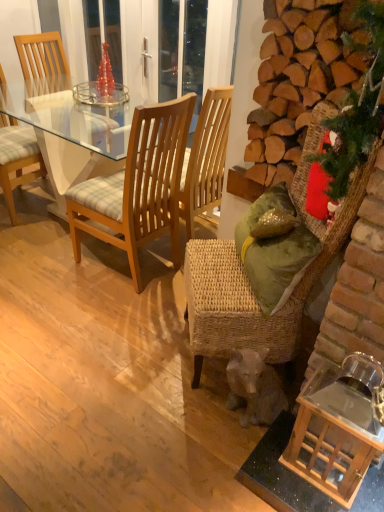
The width and height of the screenshot is (384, 512). I want to click on light brown wooden chair at left, marked as the third chair in a right-to-left arrangement, so click(x=41, y=58).

What do you see at coordinates (351, 120) in the screenshot? I see `green fabric christmas tree at right` at bounding box center [351, 120].

What is the approximate height of green fabric christmas tree at right?

green fabric christmas tree at right is 18.13 inches tall.

I want to click on wooden chair at left, arranged as the fourth chair when viewed from the right, so click(x=17, y=158).

Is woven wicker chair at right, which is counted as the 4th chair, starting from the left, touching light brown wooden chair at left, marked as the third chair in a right-to-left arrangement?

woven wicker chair at right, which is counted as the 4th chair, starting from the left, is not next to light brown wooden chair at left, marked as the third chair in a right-to-left arrangement, and they're not touching.

Can you confirm if woven wicker chair at right, which is counted as the 1th chair, starting from the right, is wider than light brown wooden chair at left, marked as the third chair in a right-to-left arrangement?

Indeed, woven wicker chair at right, which is counted as the 1th chair, starting from the right, has a greater width compared to light brown wooden chair at left, marked as the third chair in a right-to-left arrangement.

Is green fabric pillow at right aimed at woodenchair at left, acting as the second chair starting from the right?

No, green fabric pillow at right does not turn towards woodenchair at left, acting as the second chair starting from the right.

Locate an element on the screen. The height and width of the screenshot is (512, 384). pillow on the right side of woodenchair at left, positioned as the 3th chair in left-to-right order is located at coordinates (274, 252).

Is green fabric pillow at right placed right next to woodenchair at left, positioned as the 3th chair in left-to-right order?

No.

Considering the sizes of objects green fabric pillow at right and woven wicker chair at right, which is counted as the 4th chair, starting from the left, in the image provided, who is smaller, green fabric pillow at right or woven wicker chair at right, which is counted as the 4th chair, starting from the left,?

green fabric pillow at right is smaller.

Does green fabric pillow at right have a lesser height compared to woven wicker chair at right, which is counted as the 4th chair, starting from the left?

Correct, green fabric pillow at right is not as tall as woven wicker chair at right, which is counted as the 4th chair, starting from the left.

Is green fabric pillow at right in front of or behind woven wicker chair at right, which is counted as the 1th chair, starting from the right, in the image?

green fabric pillow at right is behind woven wicker chair at right, which is counted as the 1th chair, starting from the right.

The width and height of the screenshot is (384, 512). In order to click on chair lying below the green fabric pillow at right (from the image's perspective) in this screenshot , I will do `click(247, 281)`.

From a real-world perspective, relative to woodenchair at left, positioned as the 3th chair in left-to-right order, is light brown wooden chair at left, the second chair in the left-to-right sequence, vertically above or below?

light brown wooden chair at left, the second chair in the left-to-right sequence, is situated higher than woodenchair at left, positioned as the 3th chair in left-to-right order, in the real world.

In the image, is light brown wooden chair at left, marked as the third chair in a right-to-left arrangement, on the left side or the right side of woodenchair at left, positioned as the 3th chair in left-to-right order?

In the image, light brown wooden chair at left, marked as the third chair in a right-to-left arrangement, appears on the left side of woodenchair at left, positioned as the 3th chair in left-to-right order.

You are a GUI agent. You are given a task and a screenshot of the screen. Output one action in this format:
    pyautogui.click(x=<x>, y=<y>)
    Task: Click on the pillow on the right of woodenchair at left, positioned as the 3th chair in left-to-right order
    
    Given the screenshot: What is the action you would take?
    pyautogui.click(x=274, y=252)

Considering the sizes of objects woodenchair at left, positioned as the 3th chair in left-to-right order, and green fabric pillow at right in the image provided, who is shorter, woodenchair at left, positioned as the 3th chair in left-to-right order, or green fabric pillow at right?

Standing shorter between the two is green fabric pillow at right.

Relative to green fabric pillow at right, is woodenchair at left, positioned as the 3th chair in left-to-right order, in front or behind?

woodenchair at left, positioned as the 3th chair in left-to-right order, is behind green fabric pillow at right.

The width and height of the screenshot is (384, 512). What are the coordinates of `christmas decoration located on the right of green fabric pillow at right` in the screenshot? It's located at (351, 120).

Is point (313, 155) less distant than point (282, 189)?

Yes, it is in front of point (282, 189).

Considering the relative positions of green fabric christmas tree at right and green fabric pillow at right in the image provided, is green fabric christmas tree at right to the left or to the right of green fabric pillow at right?

From the image, it's evident that green fabric christmas tree at right is to the right of green fabric pillow at right.

Is green fabric christmas tree at right positioned far away from green fabric pillow at right?

No.

Is woodenchair at left, acting as the second chair starting from the right, aimed at woven wicker chair at right, which is counted as the 4th chair, starting from the left?

No.

From a real-world perspective, is woodenchair at left, positioned as the 3th chair in left-to-right order, over woven wicker chair at right, which is counted as the 4th chair, starting from the left?

No, from a real-world perspective, woodenchair at left, positioned as the 3th chair in left-to-right order, is not on top of woven wicker chair at right, which is counted as the 4th chair, starting from the left.

Is woodenchair at left, positioned as the 3th chair in left-to-right order, taller or shorter than woven wicker chair at right, which is counted as the 1th chair, starting from the right?

woodenchair at left, positioned as the 3th chair in left-to-right order, is shorter than woven wicker chair at right, which is counted as the 1th chair, starting from the right.

From the woven wicker chair at right, which is counted as the 4th chair, starting from the left, count the 2nd chair to the left and point to it. Please provide its 2D coordinates.

[(41, 58)]

At what (x,y) coordinates should I click in order to perform the action: click on pillow below the woodenchair at left, positioned as the 3th chair in left-to-right order (from the image's perspective). Please return your answer as a coordinate pair (x, y). Looking at the image, I should click on [x=274, y=252].

When comparing their distances from green fabric christmas tree at right, does green fabric pillow at right or light brown wooden chair at left, the second chair in the left-to-right sequence, seem further?

The object further to green fabric christmas tree at right is light brown wooden chair at left, the second chair in the left-to-right sequence.

When comparing their distances from light brown wooden chair at left, marked as the third chair in a right-to-left arrangement, does green fabric christmas tree at right or wooden chair at left, arranged as the fourth chair when viewed from the right, seem closer?

wooden chair at left, arranged as the fourth chair when viewed from the right, is closer to light brown wooden chair at left, marked as the third chair in a right-to-left arrangement.

Looking at the image, which one is located further to green fabric christmas tree at right, light brown wooden chair at left, the second chair in the left-to-right sequence, or wooden chair at left, the first chair when ordered from left to right?

Among the two, light brown wooden chair at left, the second chair in the left-to-right sequence, is located further to green fabric christmas tree at right.

When comparing their distances from light brown wooden chair at left, the second chair in the left-to-right sequence, does wooden chair at left, the first chair when ordered from left to right, or woodenchair at left, positioned as the 3th chair in left-to-right order, seem further?

woodenchair at left, positioned as the 3th chair in left-to-right order, is further to light brown wooden chair at left, the second chair in the left-to-right sequence.

Which object lies further to the anchor point green fabric pillow at right, woodenchair at left, positioned as the 3th chair in left-to-right order, or woven wicker chair at right, which is counted as the 4th chair, starting from the left?

The object further to green fabric pillow at right is woodenchair at left, positioned as the 3th chair in left-to-right order.

When comparing their distances from wooden chair at left, the first chair when ordered from left to right, does woven wicker chair at right, which is counted as the 1th chair, starting from the right, or green fabric christmas tree at right seem further?

green fabric christmas tree at right lies further to wooden chair at left, the first chair when ordered from left to right, than the other object.

Consider the image. Which object lies nearer to the anchor point woodenchair at left, acting as the second chair starting from the right, wooden chair at left, arranged as the fourth chair when viewed from the right, or green fabric christmas tree at right?

wooden chair at left, arranged as the fourth chair when viewed from the right, lies closer to woodenchair at left, acting as the second chair starting from the right, than the other object.

Looking at the image, which one is located further to green fabric pillow at right, woven wicker chair at right, which is counted as the 1th chair, starting from the right, or green fabric christmas tree at right?

Among the two, green fabric christmas tree at right is located further to green fabric pillow at right.

Find the location of `chair between woodenchair at left, acting as the second chair starting from the right, and green fabric pillow at right`. chair between woodenchair at left, acting as the second chair starting from the right, and green fabric pillow at right is located at coordinates (247, 281).

Where is `pillow situated between wooden chair at left, arranged as the fourth chair when viewed from the right, and green fabric christmas tree at right from left to right`? This screenshot has height=512, width=384. pillow situated between wooden chair at left, arranged as the fourth chair when viewed from the right, and green fabric christmas tree at right from left to right is located at coordinates (274, 252).

This screenshot has width=384, height=512. Find the location of `pillow located between woven wicker chair at right, which is counted as the 1th chair, starting from the right, and light brown wooden chair at left, the second chair in the left-to-right sequence, in the depth direction`. pillow located between woven wicker chair at right, which is counted as the 1th chair, starting from the right, and light brown wooden chair at left, the second chair in the left-to-right sequence, in the depth direction is located at coordinates (274, 252).

Where is `chair between wooden chair at left, the first chair when ordered from left to right, and woodenchair at left, acting as the second chair starting from the right, in the horizontal direction`? chair between wooden chair at left, the first chair when ordered from left to right, and woodenchair at left, acting as the second chair starting from the right, in the horizontal direction is located at coordinates (41, 58).